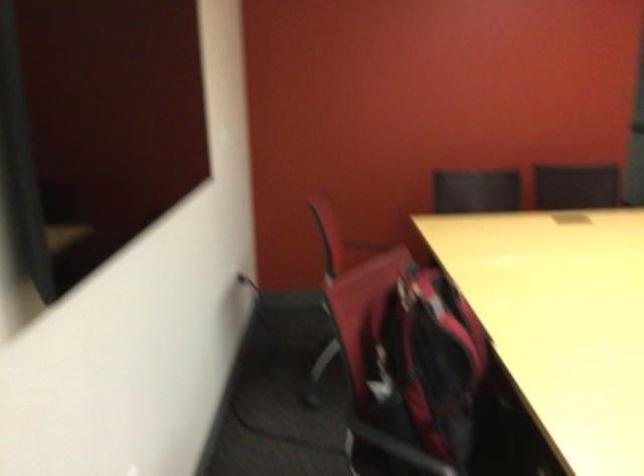
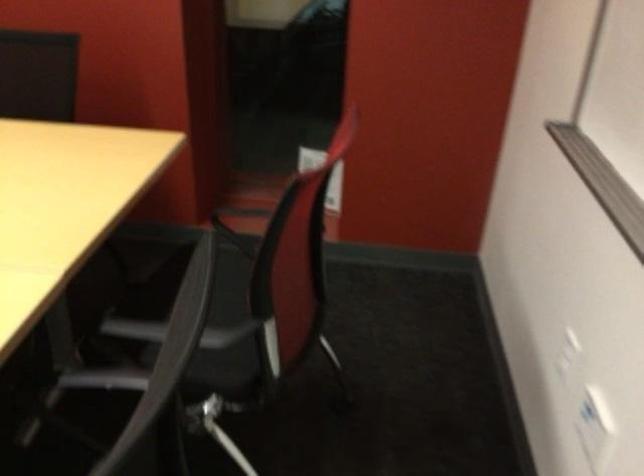
What movement of the cameraman would produce the second image?

The cameraman moved toward right, forward.